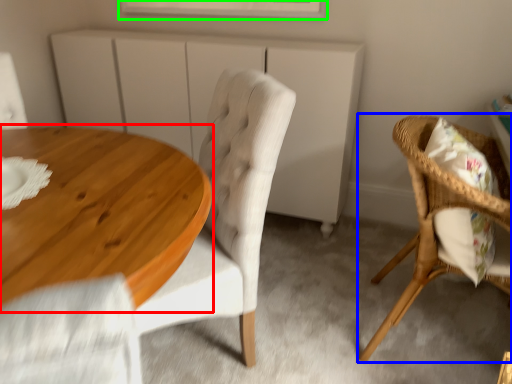
Question: Considering the real-world distances, which object is closest to coffee table (highlighted by a red box)? chair (highlighted by a blue box) or window (highlighted by a green box).

Choices:
 (A) chair
 (B) window

Answer: (A)